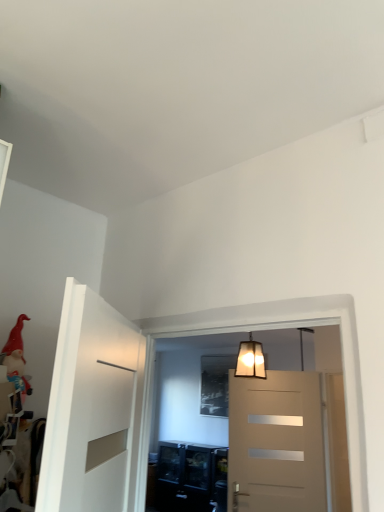
Question: Is translucent glass lampshade at upper center taller or shorter than red velvet santa hat at left?

Choices:
 (A) tall
 (B) short

Answer: (A)

Question: In the image, is translucent glass lampshade at upper center positioned in front of or behind red velvet santa hat at left?

Choices:
 (A) front
 (B) behind

Answer: (B)

Question: Looking at their shapes, would you say translucent glass lampshade at upper center is wider or thinner than red velvet santa hat at left?

Choices:
 (A) thin
 (B) wide

Answer: (A)

Question: Is red velvet santa hat at left situated inside translucent glass lampshade at upper center or outside?

Choices:
 (A) outside
 (B) inside

Answer: (A)

Question: In terms of height, does red velvet santa hat at left look taller or shorter compared to translucent glass lampshade at upper center?

Choices:
 (A) short
 (B) tall

Answer: (A)

Question: Is red velvet santa hat at left to the left or to the right of translucent glass lampshade at upper center in the image?

Choices:
 (A) right
 (B) left

Answer: (B)

Question: In terms of width, does red velvet santa hat at left look wider or thinner when compared to translucent glass lampshade at upper center?

Choices:
 (A) thin
 (B) wide

Answer: (B)